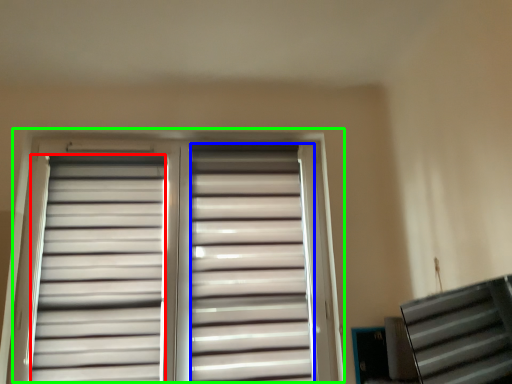
Question: Based on their relative distances, which object is nearer to shutter (highlighted by a red box)? Choose from shutter (highlighted by a blue box) and window (highlighted by a green box).

Choices:
 (A) shutter
 (B) window

Answer: (B)